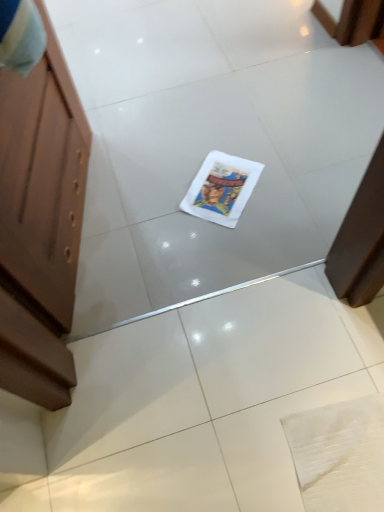
Locate an element on the screen. blank space situated above white paper comic book at center (from a real-world perspective) is located at coordinates (230, 184).